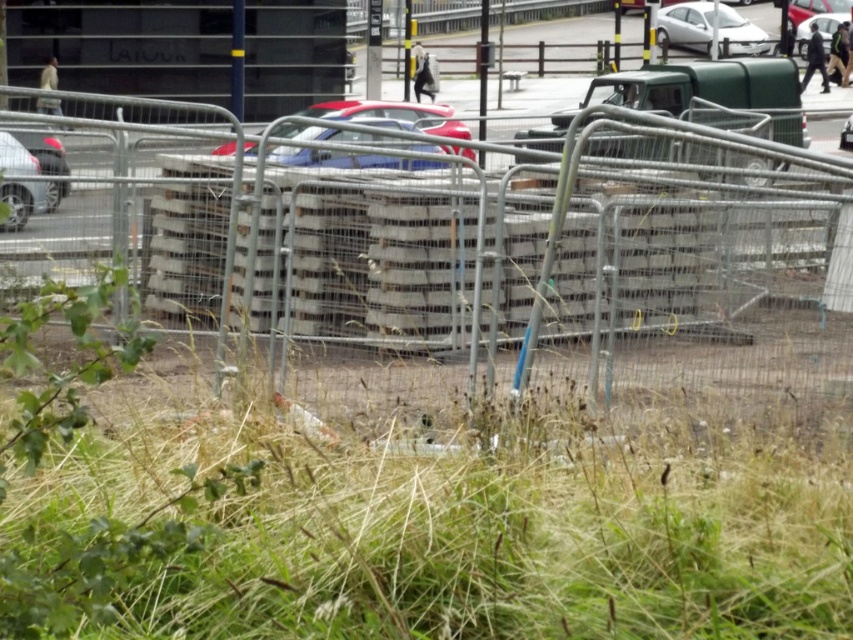
Can you confirm if white glossy car at upper center is taller than shiny metallic car at left?

Indeed, white glossy car at upper center has a greater height compared to shiny metallic car at left.

Does point (700, 28) come farther from viewer compared to point (3, 136)?

That is True.

Does point (666, 26) come in front of point (16, 141)?

No, (666, 26) is further to viewer.

In order to click on white glossy car at upper center in this screenshot , I will do `click(686, 24)`.

Who is higher up, shiny red car at center or shiny metallic car at left?

shiny red car at center

Between point (408, 102) and point (3, 136), which one is positioned in front?

Point (3, 136) is in front.

You are a GUI agent. You are given a task and a screenshot of the screen. Output one action in this format:
    pyautogui.click(x=<x>, y=<y>)
    Task: Click on the shiny red car at center
    The height and width of the screenshot is (640, 853).
    Given the screenshot: What is the action you would take?
    pyautogui.click(x=393, y=113)

Who is positioned more to the right, white glossy car at upper center or shiny red car at center?

From the viewer's perspective, white glossy car at upper center appears more on the right side.

Is white glossy car at upper center thinner than shiny red car at center?

Correct, white glossy car at upper center's width is less than shiny red car at center's.

The image size is (853, 640). In order to click on white glossy car at upper center in this screenshot , I will do `click(686, 24)`.

Locate an element on the screen. Image resolution: width=853 pixels, height=640 pixels. white glossy car at upper center is located at coordinates (686, 24).